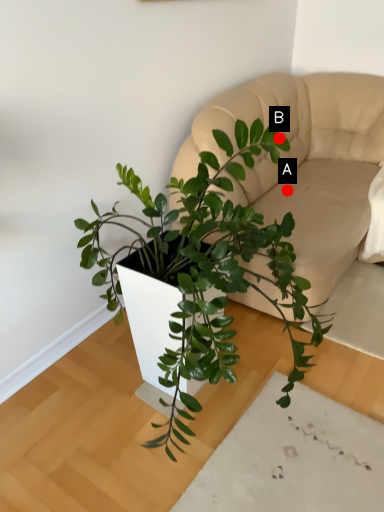
Question: Two points are circled on the image, labeled by A and B beside each circle. Which point is further to the camera?

Choices:
 (A) A is further
 (B) B is further

Answer: (A)